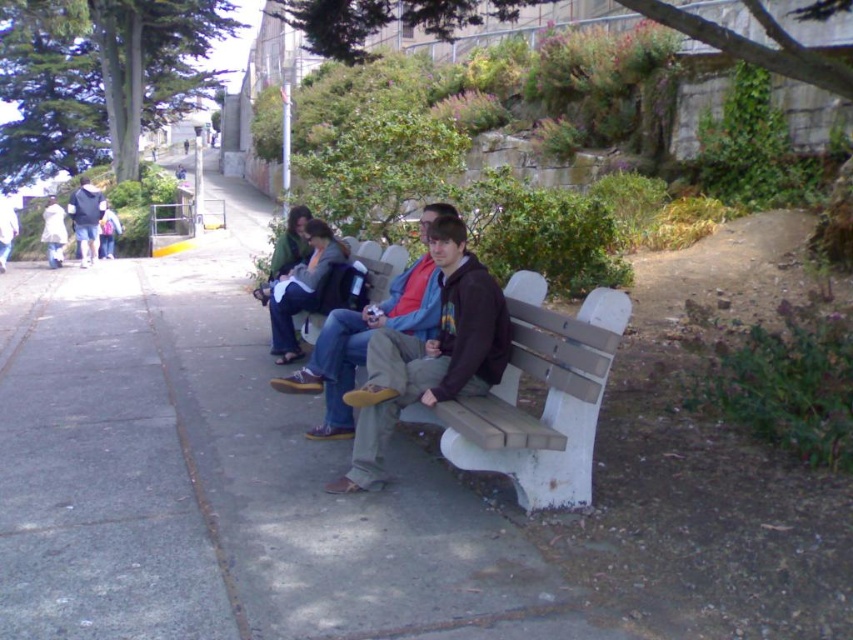
Which of these two, white wood bench at center or wooden bench at center, stands taller?

white wood bench at center

Who is more forward, (534, 467) or (381, 253)?

Point (534, 467) is in front.

Who is more forward, (515, 472) or (386, 272)?

Point (515, 472) is in front.

The height and width of the screenshot is (640, 853). In order to click on white wood bench at center in this screenshot , I will do `click(544, 401)`.

Is matte brown jacket at center bigger than dark brown leather jacket at center?

Actually, matte brown jacket at center might be smaller than dark brown leather jacket at center.

The width and height of the screenshot is (853, 640). Identify the location of matte brown jacket at center. (428, 353).

How far apart are matte brown jacket at center and wooden bench at center?

The distance of matte brown jacket at center from wooden bench at center is 2.03 meters.

This screenshot has width=853, height=640. What do you see at coordinates (428, 353) in the screenshot?
I see `matte brown jacket at center` at bounding box center [428, 353].

The height and width of the screenshot is (640, 853). I want to click on matte brown jacket at center, so click(x=428, y=353).